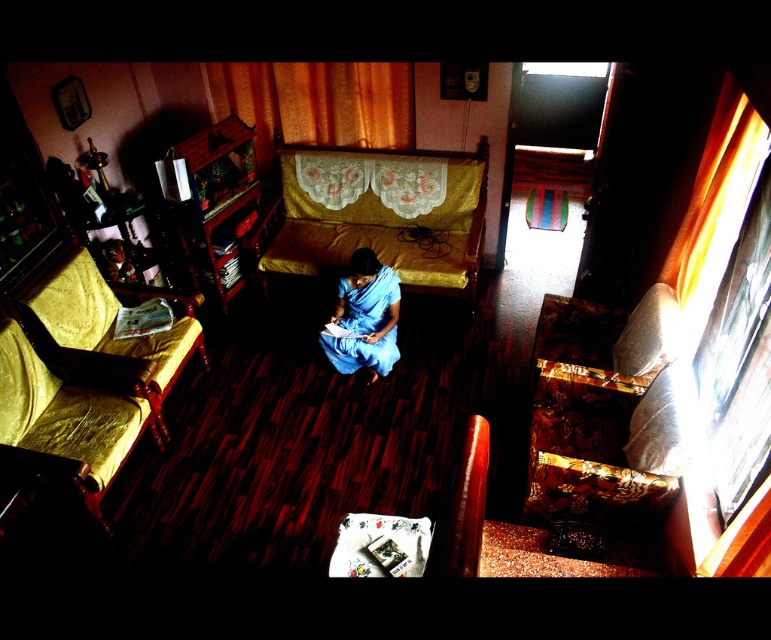
You are standing in the living room and see the gold fabric couch at left and the wooden bunk bed at left. Which one is positioned more to the left side of the room?

The gold fabric couch at left is positioned more to the left than the wooden bunk bed at left.